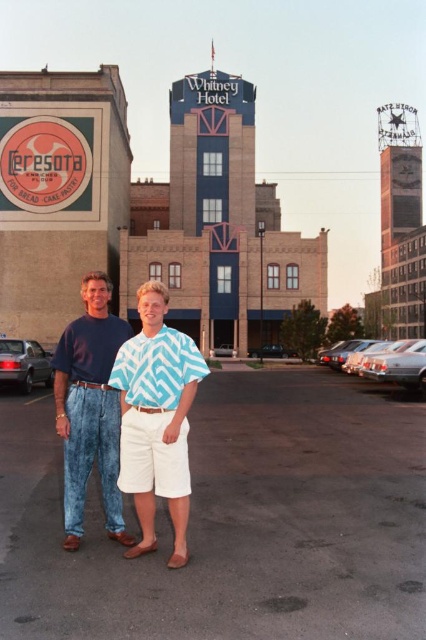
Based on the scene description, where is the denim pants at center located in the image?

The denim pants at center is located at point (89,408) in the image.

You are a photographer setting up a tripod to capture the Whitney Hotel sign in the background. You have two objects in your viewfinder, the denim pants at center and the silver metallic sedan at left. Which object should you focus on to ensure the Whitney Hotel sign is in the background?

The denim pants at center is taller than the silver metallic sedan at left, so focusing on the denim pants at center will place the Whitney Hotel sign in the background.